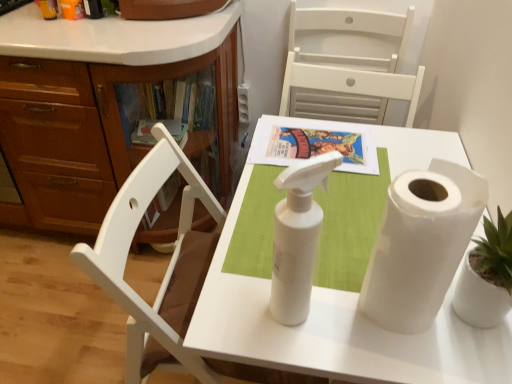
Image resolution: width=512 pixels, height=384 pixels. I want to click on free spot above white matte paper towel roll at center (from a real-world perspective), so click(x=345, y=198).